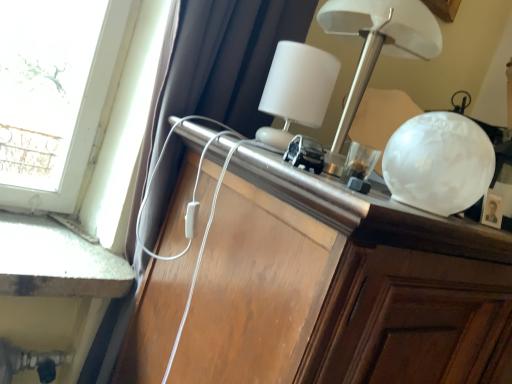
Question: Should I look upward or downward to see white glossy lamp at upper center?

Choices:
 (A) up
 (B) down

Answer: (A)

Question: Can you confirm if white glossy lamp at upper center is thinner than wooden cabinet at center?

Choices:
 (A) yes
 (B) no

Answer: (A)

Question: Is white glossy lamp at upper center to the left of wooden cabinet at center from the viewer's perspective?

Choices:
 (A) no
 (B) yes

Answer: (B)

Question: Can you confirm if white glossy lamp at upper center is bigger than wooden cabinet at center?

Choices:
 (A) yes
 (B) no

Answer: (B)

Question: From the image's perspective, is white glossy lamp at upper center over wooden cabinet at center?

Choices:
 (A) no
 (B) yes

Answer: (B)

Question: From the image's perspective, is white glossy lamp at upper center under wooden cabinet at center?

Choices:
 (A) yes
 (B) no

Answer: (B)

Question: From a real-world perspective, is white glossy lamp at upper center on top of wooden cabinet at center?

Choices:
 (A) no
 (B) yes

Answer: (B)

Question: Is white matte table lamp at upper center closer to camera compared to wooden cabinet at center?

Choices:
 (A) no
 (B) yes

Answer: (A)

Question: From the image's perspective, is white matte table lamp at upper center above wooden cabinet at center?

Choices:
 (A) yes
 (B) no

Answer: (A)

Question: Considering the relative positions of white matte table lamp at upper center and wooden cabinet at center in the image provided, is white matte table lamp at upper center to the right of wooden cabinet at center from the viewer's perspective?

Choices:
 (A) yes
 (B) no

Answer: (B)

Question: Is white matte table lamp at upper center with wooden cabinet at center?

Choices:
 (A) no
 (B) yes

Answer: (A)

Question: Is white matte table lamp at upper center wider than wooden cabinet at center?

Choices:
 (A) yes
 (B) no

Answer: (B)

Question: Does white matte table lamp at upper center have a smaller size compared to wooden cabinet at center?

Choices:
 (A) no
 (B) yes

Answer: (B)

Question: Considering the relative sizes of wooden cabinet at center and white matte table lamp at upper center in the image provided, is wooden cabinet at center bigger than white matte table lamp at upper center?

Choices:
 (A) yes
 (B) no

Answer: (A)